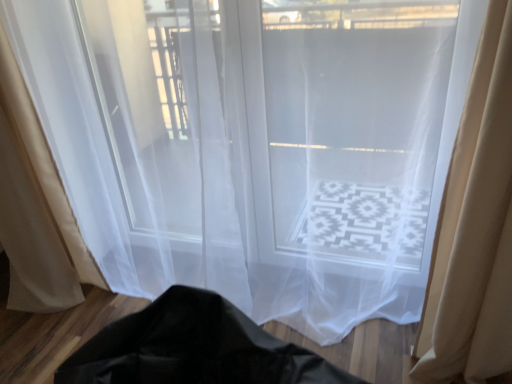
Question: Is beige sheer curtain at left, the first curtain positioned from the left, spatially inside beige sheer curtain at right, the 2th curtain viewed from the left, or outside of it?

Choices:
 (A) outside
 (B) inside

Answer: (A)

Question: From a real-world perspective, is beige sheer curtain at left, the first curtain positioned from the left, positioned above or below beige sheer curtain at right, the 2th curtain viewed from the left?

Choices:
 (A) above
 (B) below

Answer: (A)

Question: From the image's perspective, is beige sheer curtain at left, the first curtain positioned from the left, above or below beige sheer curtain at right, the 2th curtain viewed from the left?

Choices:
 (A) above
 (B) below

Answer: (A)

Question: Which is correct: beige sheer curtain at right, which is counted as the first curtain, starting from the right, is inside beige sheer curtain at left, the first curtain positioned from the left, or outside of it?

Choices:
 (A) outside
 (B) inside

Answer: (A)

Question: From the image's perspective, relative to beige sheer curtain at left, positioned as the second curtain in right-to-left order, is beige sheer curtain at right, which is counted as the first curtain, starting from the right, above or below?

Choices:
 (A) above
 (B) below

Answer: (B)

Question: In terms of size, does beige sheer curtain at right, which is counted as the first curtain, starting from the right, appear bigger or smaller than beige sheer curtain at left, the first curtain positioned from the left?

Choices:
 (A) small
 (B) big

Answer: (A)

Question: Looking at their shapes, would you say beige sheer curtain at right, which is counted as the first curtain, starting from the right, is wider or thinner than beige sheer curtain at left, the first curtain positioned from the left?

Choices:
 (A) thin
 (B) wide

Answer: (A)